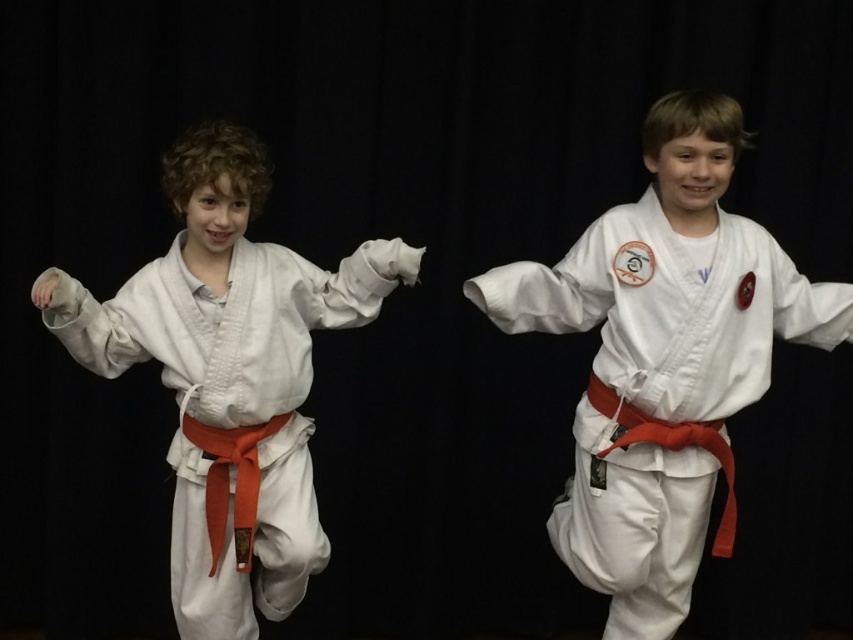
Is white matte karate uniform at center thinner than white cotton karate uniform at left?

In fact, white matte karate uniform at center might be wider than white cotton karate uniform at left.

Is point (672, 440) in front of point (277, 602)?

Yes, it is.

You are a GUI agent. You are given a task and a screenshot of the screen. Output one action in this format:
    pyautogui.click(x=<x>, y=<y>)
    Task: Click on the white matte karate uniform at center
    
    Given the screenshot: What is the action you would take?
    pyautogui.click(x=663, y=358)